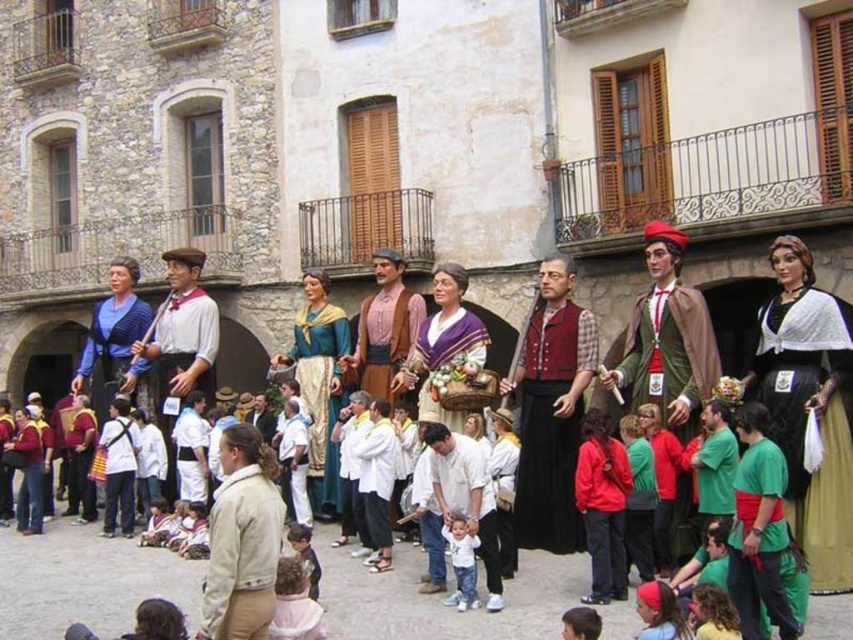
You are a photographer standing in the town square and want to take a photo of both the black velvet dress at center and the white cotton shirt at center. Which one should you position to the left in your camera frame to capture both correctly?

To capture both the black velvet dress at center and the white cotton shirt at center correctly, you should position the white cotton shirt at center to the left in your camera frame since the black velvet dress at center is to the right of it.

You are a photographer at the event and want to capture both the black velvet dress at center and the rustic brown fabric at center in a single frame. Do you need to adjust your camera angle to ensure both are fully visible?

The black velvet dress at center might be wider than rustic brown fabric at center, so adjusting the camera angle might be necessary to ensure both are fully visible in the frame.